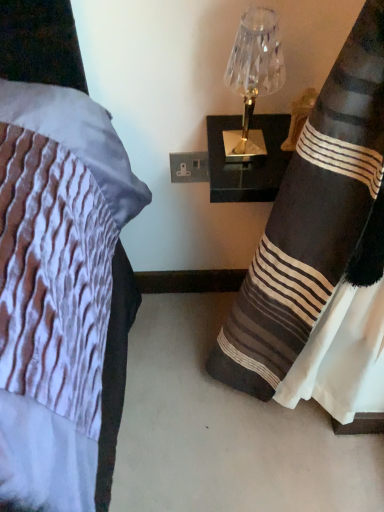
From the picture: What is the approximate height of black striped fabric at right?

black striped fabric at right is 29.34 inches in height.

Where is `black striped fabric at right`? The image size is (384, 512). black striped fabric at right is located at coordinates (315, 221).

What do you see at coordinates (315, 221) in the screenshot? This screenshot has width=384, height=512. I see `black striped fabric at right` at bounding box center [315, 221].

In order to click on clear glass lamp at upper right in this screenshot , I will do `click(253, 75)`.

Describe the element at coordinates (253, 75) in the screenshot. I see `clear glass lamp at upper right` at that location.

Locate an element on the screen. The image size is (384, 512). black striped fabric at right is located at coordinates (315, 221).

Would you say black striped fabric at right is to the left or to the right of clear glass lamp at upper right in the picture?

In the image, black striped fabric at right appears on the right side of clear glass lamp at upper right.

Which object is more forward, black striped fabric at right or clear glass lamp at upper right?

black striped fabric at right is more forward.

Does point (294, 168) come closer to viewer compared to point (266, 45)?

Yes.

In the scene shown: From the image's perspective, which one is positioned lower, black striped fabric at right or clear glass lamp at upper right?

black striped fabric at right appears lower in the image.

From a real-world perspective, is black striped fabric at right positioned above or below clear glass lamp at upper right?

black striped fabric at right is below clear glass lamp at upper right.

Considering the sizes of objects black striped fabric at right and clear glass lamp at upper right in the image provided, who is thinner, black striped fabric at right or clear glass lamp at upper right?

clear glass lamp at upper right.

Does black striped fabric at right have a greater height compared to clear glass lamp at upper right?

Correct, black striped fabric at right is much taller as clear glass lamp at upper right.

Who is smaller, black striped fabric at right or clear glass lamp at upper right?

Smaller between the two is clear glass lamp at upper right.

Is black striped fabric at right located outside clear glass lamp at upper right?

Indeed, black striped fabric at right is completely outside clear glass lamp at upper right.

Based on the photo, are black striped fabric at right and clear glass lamp at upper right far apart?

Actually, black striped fabric at right and clear glass lamp at upper right are a little close together.

Is black striped fabric at right facing away from clear glass lamp at upper right?

No, black striped fabric at right is not facing the opposite direction of clear glass lamp at upper right.

Where is `curtain on the right side of clear glass lamp at upper right`? curtain on the right side of clear glass lamp at upper right is located at coordinates (315, 221).

Which object is positioned more to the right, clear glass lamp at upper right or black striped fabric at right?

Positioned to the right is black striped fabric at right.

Between clear glass lamp at upper right and black striped fabric at right, which one is positioned in front?

black striped fabric at right is closer to the camera.

Which is behind, point (263, 44) or point (235, 382)?

The point (235, 382) is behind.

From the image's perspective, is clear glass lamp at upper right located beneath black striped fabric at right?

Actually, clear glass lamp at upper right appears above black striped fabric at right in the image.

From a real-world perspective, is clear glass lamp at upper right below black striped fabric at right?

No, from a real-world perspective, clear glass lamp at upper right is not beneath black striped fabric at right.

Looking at their sizes, would you say clear glass lamp at upper right is wider or thinner than black striped fabric at right?

In the image, clear glass lamp at upper right appears to be more narrow than black striped fabric at right.

Who is taller, clear glass lamp at upper right or black striped fabric at right?

Standing taller between the two is black striped fabric at right.

Is clear glass lamp at upper right bigger than black striped fabric at right?

No, clear glass lamp at upper right is not bigger than black striped fabric at right.

Is clear glass lamp at upper right spatially inside black striped fabric at right, or outside of it?

clear glass lamp at upper right lies outside black striped fabric at right.

Is clear glass lamp at upper right not near black striped fabric at right?

No, there isn't a large distance between clear glass lamp at upper right and black striped fabric at right.

Is clear glass lamp at upper right aimed at black striped fabric at right?

Yes.

I want to click on curtain that appears below the clear glass lamp at upper right (from the image's perspective), so click(315, 221).

This screenshot has width=384, height=512. There is a black striped fabric at right. What are the coordinates of `lamp above it (from a real-world perspective)` in the screenshot? It's located at click(253, 75).

Locate an element on the screen. This screenshot has width=384, height=512. curtain located on the right of clear glass lamp at upper right is located at coordinates (315, 221).